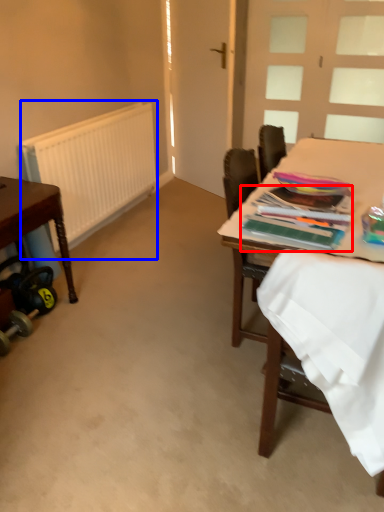
Question: Among these objects, which one is nearest to the camera, magazine (highlighted by a red box) or radiator (highlighted by a blue box)?

Choices:
 (A) magazine
 (B) radiator

Answer: (A)